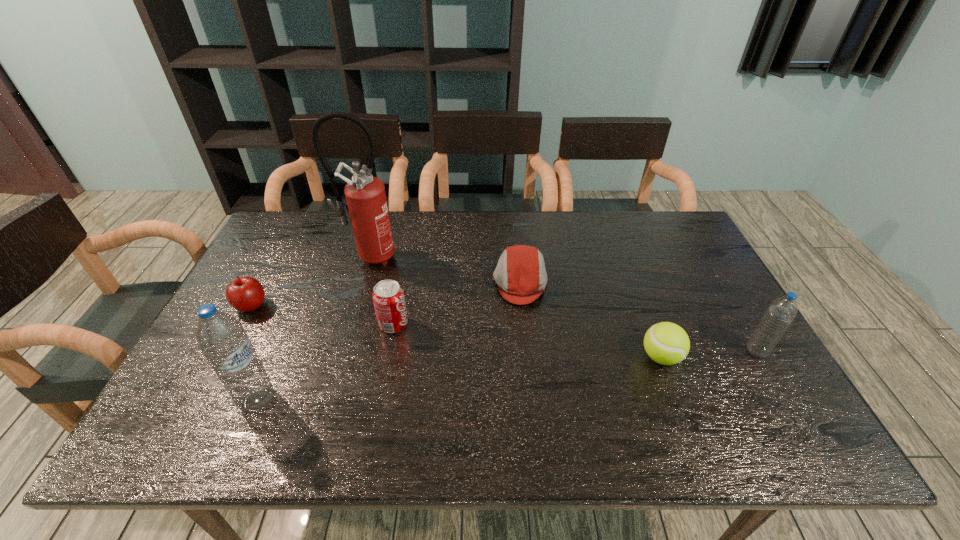
Find the location of a particular element. The width and height of the screenshot is (960, 540). water bottle present at the left edge is located at coordinates (221, 337).

The image size is (960, 540). Find the location of `apple positioned at the left edge`. apple positioned at the left edge is located at coordinates (246, 294).

Find the location of `object situated at the right edge`. object situated at the right edge is located at coordinates (781, 312).

At what (x,y) coordinates should I click in order to perform the action: click on object that is positioned at the near left corner. Please return your answer as a coordinate pair (x, y). The height and width of the screenshot is (540, 960). Looking at the image, I should click on (221, 337).

The image size is (960, 540). In order to click on vacant space at the far edge in this screenshot , I will do `click(403, 251)`.

Image resolution: width=960 pixels, height=540 pixels. Find the location of `blank area at the left edge`. blank area at the left edge is located at coordinates (276, 262).

You are a GUI agent. You are given a task and a screenshot of the screen. Output one action in this format:
    pyautogui.click(x=<x>, y=<y>)
    Task: Click on the vacant space at the right edge of the desktop
    
    Given the screenshot: What is the action you would take?
    pyautogui.click(x=672, y=273)

In the image, there is a desktop. Where is `vacant space at the far right corner`? This screenshot has width=960, height=540. vacant space at the far right corner is located at coordinates (670, 241).

The image size is (960, 540). I want to click on free space between the taller water bottle and the soda, so click(325, 362).

Image resolution: width=960 pixels, height=540 pixels. Find the location of `vacant area between the apple and the fourth tallest object`. vacant area between the apple and the fourth tallest object is located at coordinates (323, 315).